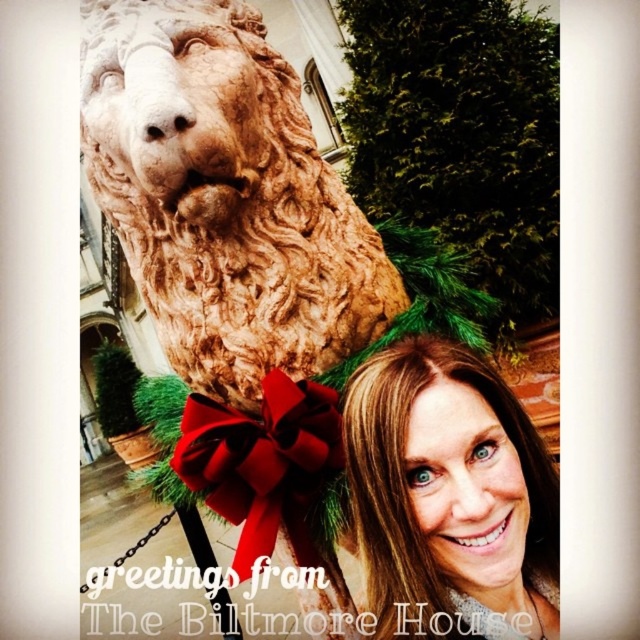
Question: Which point appears closest to the camera in this image?

Choices:
 (A) pyautogui.click(x=86, y=83)
 (B) pyautogui.click(x=292, y=381)
 (C) pyautogui.click(x=436, y=448)

Answer: (C)

Question: Does brown stone lion at upper left appear on the left side of red satin bow at center?

Choices:
 (A) no
 (B) yes

Answer: (B)

Question: Among these objects, which one is farthest from the camera?

Choices:
 (A) blonde hair at center
 (B) brown stone lion at upper left

Answer: (B)

Question: Estimate the real-world distances between objects in this image. Which object is closer to the blonde hair at center?

Choices:
 (A) red satin bow at center
 (B) brown stone lion at upper left

Answer: (A)

Question: Where is brown stone lion at upper left located in relation to blonde hair at center in the image?

Choices:
 (A) below
 (B) above

Answer: (B)

Question: Is brown stone lion at upper left positioned in front of blonde hair at center?

Choices:
 (A) no
 (B) yes

Answer: (A)